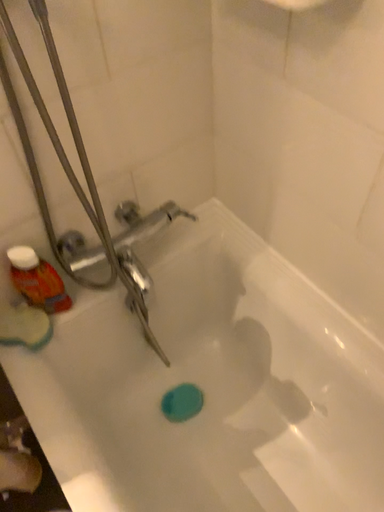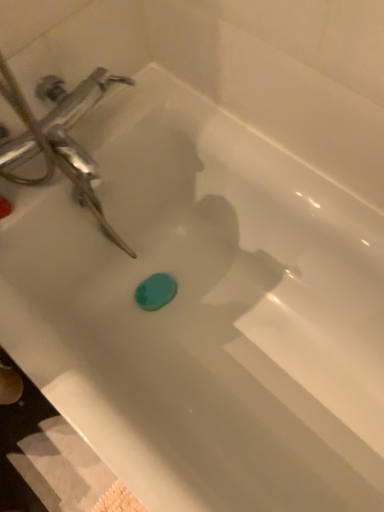
Question: Which way did the camera rotate in the video?

Choices:
 (A) rotated downward
 (B) rotated upward

Answer: (A)